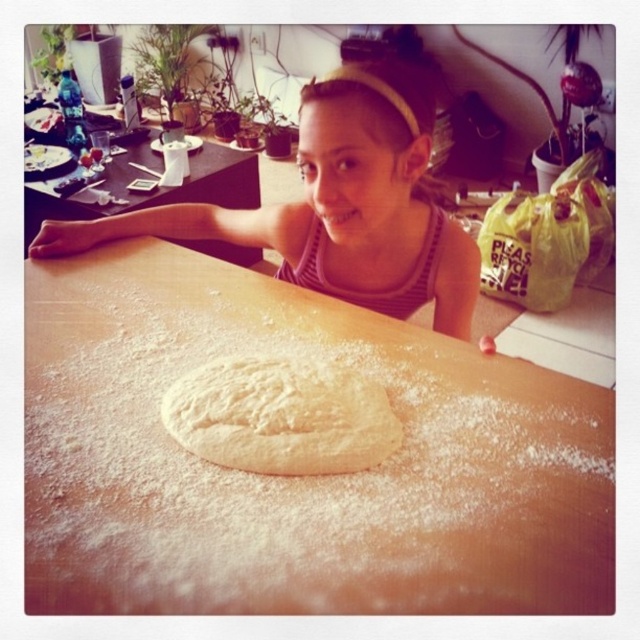
Question: In this image, where is pink striped tank top at upper center located relative to white dough at center?

Choices:
 (A) above
 (B) below

Answer: (A)

Question: Is wooden at center closer to camera compared to pink striped tank top at upper center?

Choices:
 (A) yes
 (B) no

Answer: (A)

Question: Which point is farther from the camera taking this photo?

Choices:
 (A) (312, 442)
 (B) (138, 161)
 (C) (81, 413)
 (D) (227, 216)

Answer: (B)

Question: Which point is farther to the camera?

Choices:
 (A) (225, 301)
 (B) (29, 220)
 (C) (438, 316)

Answer: (B)

Question: Which of the following is the closest to the observer?

Choices:
 (A) pink striped tank top at upper center
 (B) wooden at center
 (C) white dough at center

Answer: (B)

Question: Is wooden at center to the right of pink striped tank top at upper center from the viewer's perspective?

Choices:
 (A) no
 (B) yes

Answer: (A)